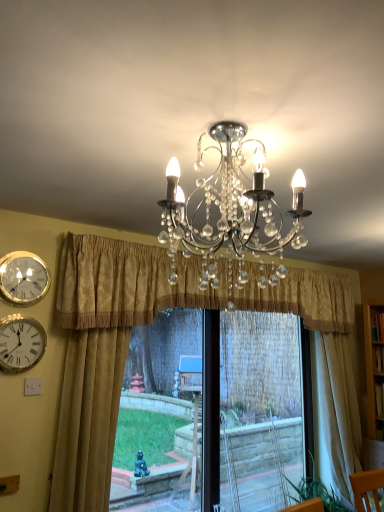
Question: Is point (162, 296) closer or farther from the camera than point (317, 351)?

Choices:
 (A) closer
 (B) farther

Answer: (A)

Question: From the image's perspective, relative to beige fabric curtain at right, the first curtain when ordered from right to left, is gold textured curtain at center, which ranks as the 2th curtain in right-to-left order, above or below?

Choices:
 (A) below
 (B) above

Answer: (B)

Question: Which of these objects is positioned farthest from the white glossy wall clock at left, which is counted as the 2th wall clock, starting from the top?

Choices:
 (A) gold textured curtain at left, the 1th curtain when ordered from left to right
 (B) gold metallic wall clock at upper left, which is counted as the first wall clock, starting from the top
 (C) gold textured curtain at center, which ranks as the 2th curtain in right-to-left order
 (D) black plastic window frame at center
 (E) beige fabric curtain at right, positioned as the third curtain in left-to-right order

Answer: (D)

Question: Which of these objects is positioned farthest from the gold metallic wall clock at upper left, which is counted as the first wall clock, starting from the top?

Choices:
 (A) gold textured curtain at left, the 1th curtain when ordered from left to right
 (B) gold textured curtain at center, which ranks as the 2th curtain in right-to-left order
 (C) white glossy wall clock at left, which is counted as the 2th wall clock, starting from the top
 (D) beige fabric curtain at right, positioned as the third curtain in left-to-right order
 (E) black plastic window frame at center

Answer: (E)